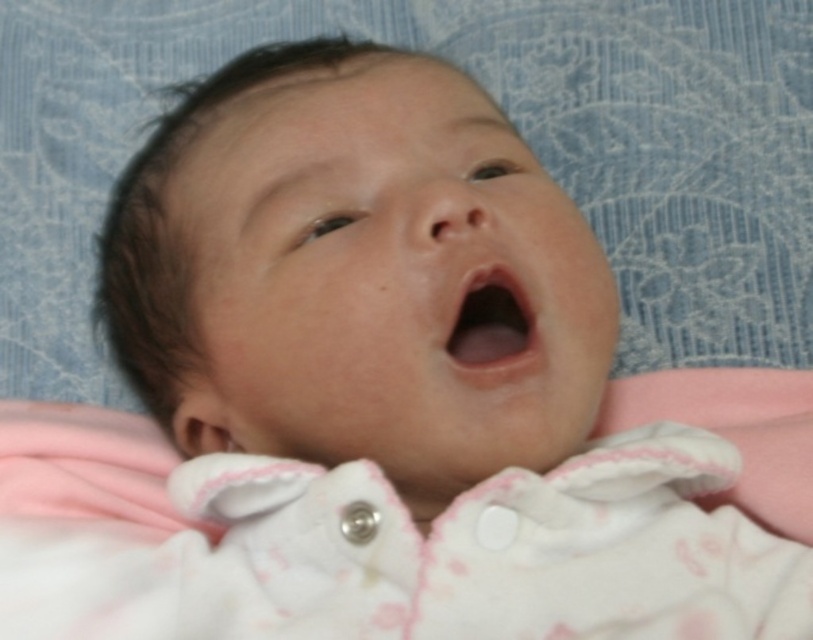
Question: In this image, where is pink fabric at center located relative to pink smooth skin at center?

Choices:
 (A) above
 (B) below

Answer: (B)

Question: Which object appears closest to the camera in this image?

Choices:
 (A) pink smooth skin at center
 (B) pink fabric at center

Answer: (B)

Question: In this image, where is pink fabric at center located relative to pink smooth skin at center?

Choices:
 (A) right
 (B) left

Answer: (B)

Question: Which point is farther to the camera?

Choices:
 (A) pink smooth skin at center
 (B) pink fabric at center

Answer: (A)

Question: Considering the relative positions of pink fabric at center and pink smooth skin at center in the image provided, where is pink fabric at center located with respect to pink smooth skin at center?

Choices:
 (A) below
 (B) above

Answer: (A)